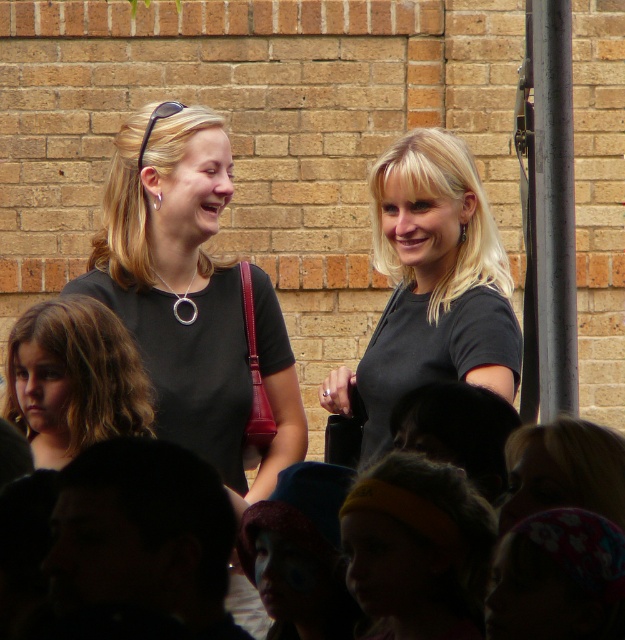
Between black matte shirt at center and blonde hair at lower left, which one appears on the right side from the viewer's perspective?

From the viewer's perspective, black matte shirt at center appears more on the right side.

The height and width of the screenshot is (640, 625). In order to click on black matte shirt at center in this screenshot , I will do `click(431, 285)`.

Can you confirm if matte black shirt at center is positioned below black matte shirt at center?

Yes, matte black shirt at center is below black matte shirt at center.

I want to click on matte black shirt at center, so click(x=191, y=296).

This screenshot has width=625, height=640. What do you see at coordinates (431, 285) in the screenshot?
I see `black matte shirt at center` at bounding box center [431, 285].

Find the location of a particular element. black matte shirt at center is located at coordinates (431, 285).